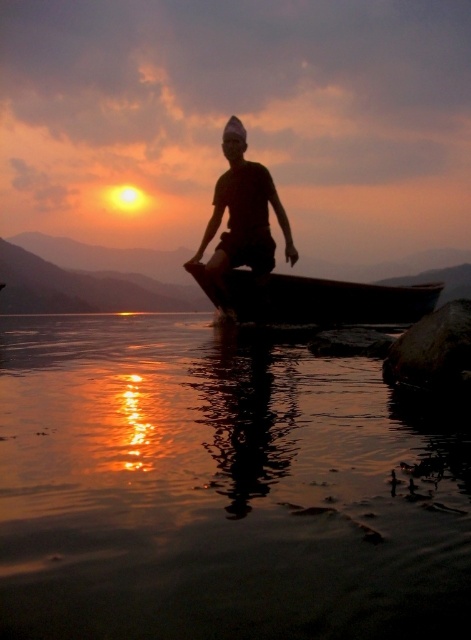
You are a photographer trying to capture the sunset scene. You notice the transparent water at center and the matte black shirt at center in your viewfinder. Which object should you adjust your focus to ensure the wider one is in sharp focus?

The transparent water at center is wider than the matte black shirt at center, so you should focus on the transparent water at center to ensure the wider object is in sharp focus.

You are a photographer planning to take a photo of the wooden canoe at center and the transparent water at center. The camera you are using has a maximum focus range of 5 meters. Can you capture both subjects in focus without moving the camera?

The transparent water at center is 5.29 meters away from the wooden canoe at center. Since the camera can only focus up to 5 meters, the distance between them exceeds the focus range. Therefore, you cannot capture both subjects in focus without moving the camera.

You are a photographer trying to capture the sunset scene. You notice a point at coordinates (316, 298) in the image. Based on the scene description, what object is this point located on?

The point at coordinates (316, 298) is located on the wooden canoe at center.